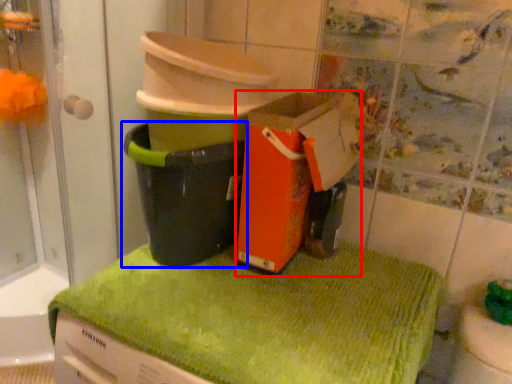
Question: Which object is closer to the camera taking this photo, cardboard box (highlighted by a red box) or waste container (highlighted by a blue box)?

Choices:
 (A) cardboard box
 (B) waste container

Answer: (A)